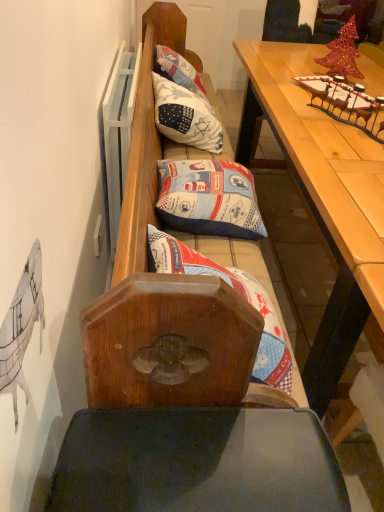
Question: Can printed fabric pillow at center, which is the 1th pillow from bottom to top, be found inside blue fabric pillow at center, placed as the 2th pillow when sorted from bottom to top?

Choices:
 (A) no
 (B) yes

Answer: (A)

Question: Does blue fabric pillow at center, which appears as the second pillow when viewed from the front, come behind printed fabric pillow at center, arranged as the 3th pillow when viewed from the top?

Choices:
 (A) yes
 (B) no

Answer: (A)

Question: Is blue fabric pillow at center, placed as the 2th pillow when sorted from bottom to top, in front of printed fabric pillow at center, which is counted as the 1th pillow, starting from the front?

Choices:
 (A) no
 (B) yes

Answer: (A)

Question: Considering the relative sizes of blue fabric pillow at center, which appears as the second pillow when viewed from the front, and printed fabric pillow at center, which is the 1th pillow from bottom to top, in the image provided, is blue fabric pillow at center, which appears as the second pillow when viewed from the front, shorter than printed fabric pillow at center, which is the 1th pillow from bottom to top,?

Choices:
 (A) no
 (B) yes

Answer: (B)

Question: Would you say blue fabric pillow at center, placed as the 2th pillow when sorted from bottom to top, is a long distance from printed fabric pillow at center, which is counted as the 1th pillow, starting from the front?

Choices:
 (A) no
 (B) yes

Answer: (A)

Question: From a real-world perspective, is blue fabric pillow at center, which is the second pillow in back-to-front order, on top of printed fabric pillow at center, which is the 1th pillow from bottom to top?

Choices:
 (A) yes
 (B) no

Answer: (B)

Question: Is blue fabric pillow at center, which appears as the second pillow when viewed from the front, aimed at white fabric pillow at center, the 3th pillow ordered from the bottom?

Choices:
 (A) no
 (B) yes

Answer: (A)

Question: Considering the relative positions of blue fabric pillow at center, which is the second pillow in back-to-front order, and white fabric pillow at center, the first pillow viewed from the back, in the image provided, is blue fabric pillow at center, which is the second pillow in back-to-front order, to the left of white fabric pillow at center, the first pillow viewed from the back, from the viewer's perspective?

Choices:
 (A) yes
 (B) no

Answer: (B)

Question: Is blue fabric pillow at center, which is the second pillow in back-to-front order, completely or partially outside of white fabric pillow at center, positioned as the third pillow in front-to-back order?

Choices:
 (A) yes
 (B) no

Answer: (A)

Question: From the image's perspective, is blue fabric pillow at center, which appears as the second pillow when viewed from the front, on top of white fabric pillow at center, positioned as the third pillow in front-to-back order?

Choices:
 (A) no
 (B) yes

Answer: (A)

Question: Does blue fabric pillow at center, the second pillow when ordered from top to bottom, have a greater height compared to white fabric pillow at center, the 3th pillow ordered from the bottom?

Choices:
 (A) yes
 (B) no

Answer: (B)

Question: From a real-world perspective, is blue fabric pillow at center, which is the second pillow in back-to-front order, on white fabric pillow at center, the 3th pillow ordered from the bottom?

Choices:
 (A) no
 (B) yes

Answer: (A)

Question: Is wooden table at upper right taller than white fabric pillow at center, the 3th pillow ordered from the bottom?

Choices:
 (A) yes
 (B) no

Answer: (A)